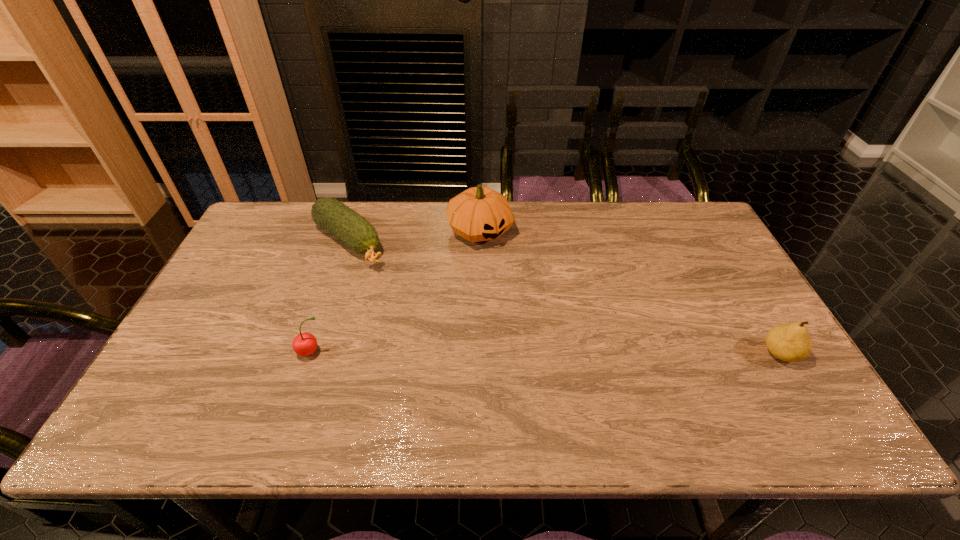
Find the location of a particular element. This screenshot has width=960, height=540. vacant space on the desktop that is between the cherry and the rightmost object and is positioned on the side of the gourd with the carved face is located at coordinates (594, 353).

Identify the location of free spot on the desktop that is between the cherry and the pear and is positioned at the blossom end of the shortest object. (480, 353).